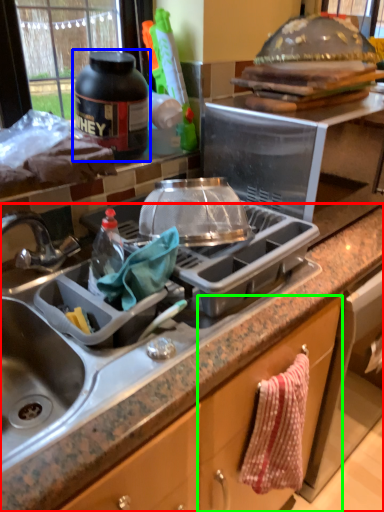
Question: Based on their relative distances, which object is farther from countertop (highlighted by a red box)? Choose from bottle (highlighted by a blue box) and cabinetry (highlighted by a green box).

Choices:
 (A) bottle
 (B) cabinetry

Answer: (A)